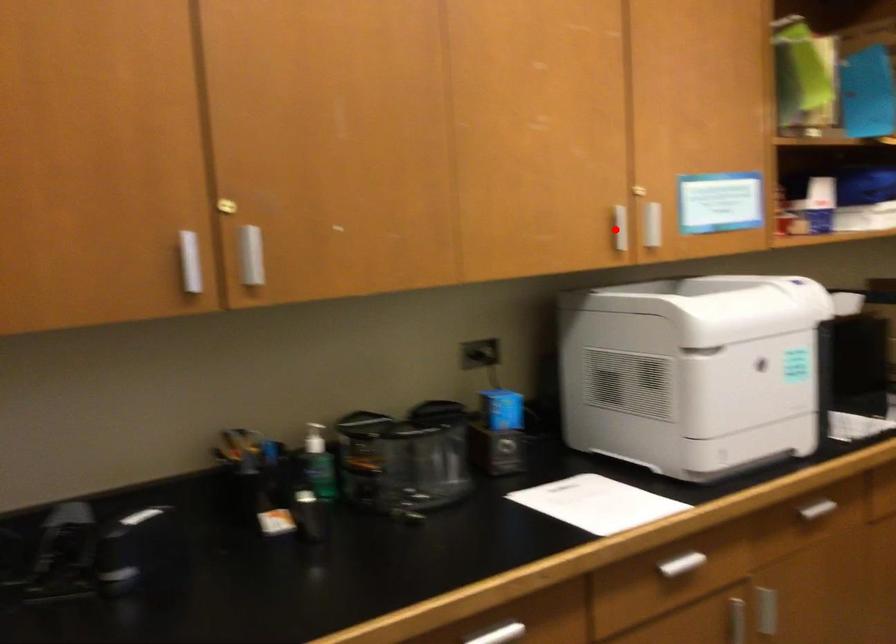
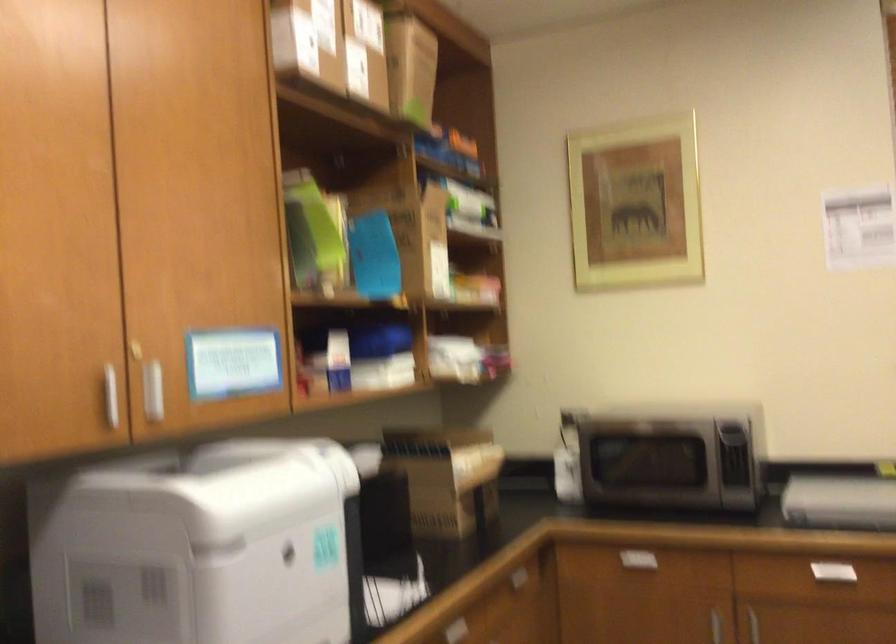
Where in the second image is the point corresponding to the highlighted location from the first image?

(110, 395)